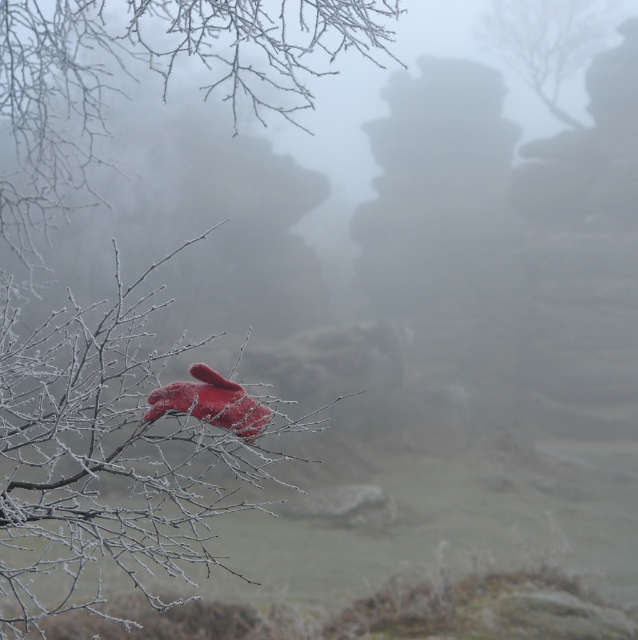
Question: Which point is closer to the camera?

Choices:
 (A) (144, 45)
 (B) (568, 16)

Answer: (A)

Question: Can you confirm if frosted branches at upper left is positioned to the left of smooth bark tree at upper right?

Choices:
 (A) yes
 (B) no

Answer: (A)

Question: Is frosted branches at upper left below smooth bark tree at upper right?

Choices:
 (A) no
 (B) yes

Answer: (B)

Question: Does frosted branches at upper left appear on the left side of smooth bark tree at upper right?

Choices:
 (A) yes
 (B) no

Answer: (A)

Question: Which of the following is the closest to the observer?

Choices:
 (A) smooth bark tree at upper right
 (B) frosted branches at upper left

Answer: (B)